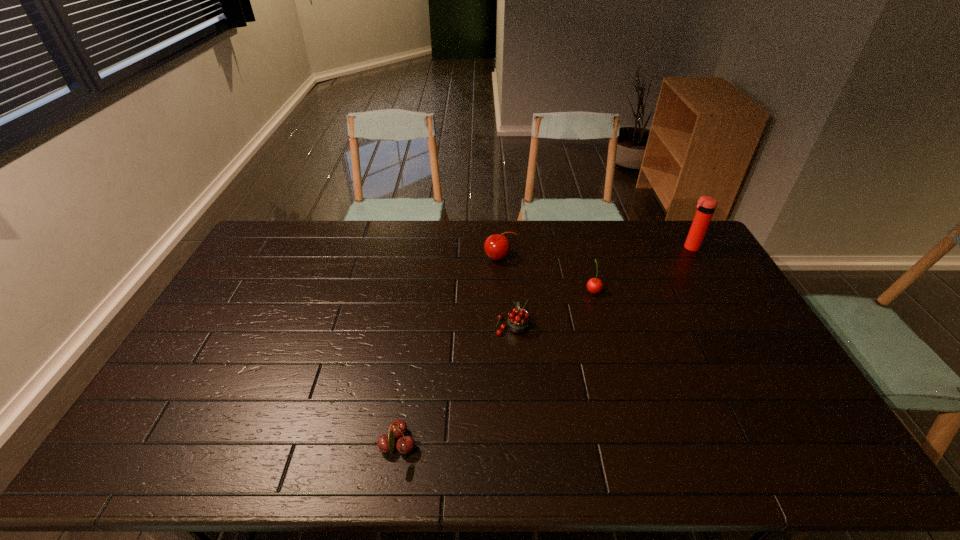
Identify the location of vacant space that satisfies the following two spatial constraints: 1. on the handle side of the second nearest cherry; 2. on the left side of the rightmost object. (506, 247).

At what (x,y) coordinates should I click in order to perform the action: click on vacant space that satisfies the following two spatial constraints: 1. on the handle side of the tallest object; 2. on the right side of the third farthest cherry. Please return your answer as a coordinate pair (x, y). This screenshot has width=960, height=540. Looking at the image, I should click on (506, 247).